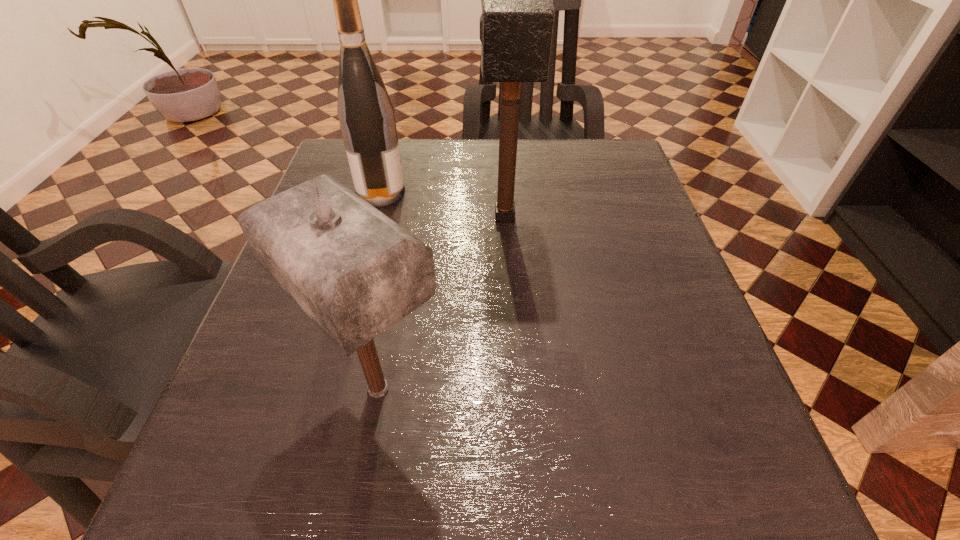
The height and width of the screenshot is (540, 960). I want to click on object present at the near edge, so click(355, 272).

The height and width of the screenshot is (540, 960). I want to click on wine bottle that is at the left edge, so click(x=366, y=115).

At what (x,y) coordinates should I click in order to perform the action: click on mallet at the left edge. Please return your answer as a coordinate pair (x, y). Looking at the image, I should click on (355, 272).

Where is `object at the far left corner`? The width and height of the screenshot is (960, 540). object at the far left corner is located at coordinates (366, 115).

Locate an element on the screen. This screenshot has height=540, width=960. object at the near left corner is located at coordinates (355, 272).

Image resolution: width=960 pixels, height=540 pixels. In order to click on vacant space at the left edge of the desktop in this screenshot , I will do `click(299, 364)`.

You are a GUI agent. You are given a task and a screenshot of the screen. Output one action in this format:
    pyautogui.click(x=<x>, y=<y>)
    Task: Click on the free space at the right edge of the desktop
    Image resolution: width=960 pixels, height=540 pixels.
    Given the screenshot: What is the action you would take?
    pyautogui.click(x=630, y=221)

The image size is (960, 540). Identify the location of vacant region at the far left corner of the desktop. (331, 170).

Identify the location of vacant space at the far right corner. (629, 157).

Locate an element on the screen. Image resolution: width=960 pixels, height=540 pixels. unoccupied position between the farther mallet and the wine bottle is located at coordinates (443, 204).